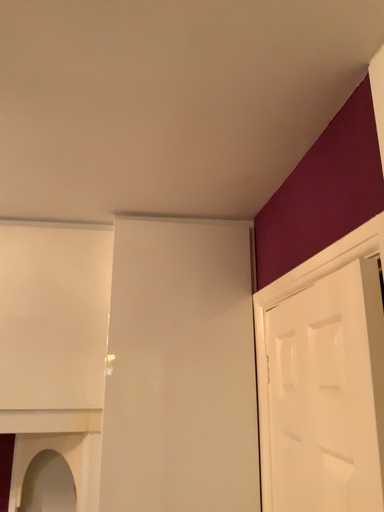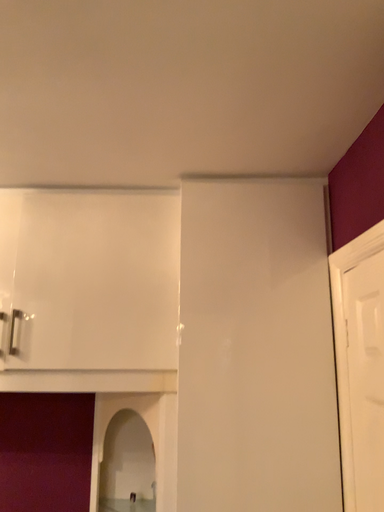
Question: How did the camera likely rotate when shooting the video?

Choices:
 (A) rotated right
 (B) rotated left

Answer: (B)